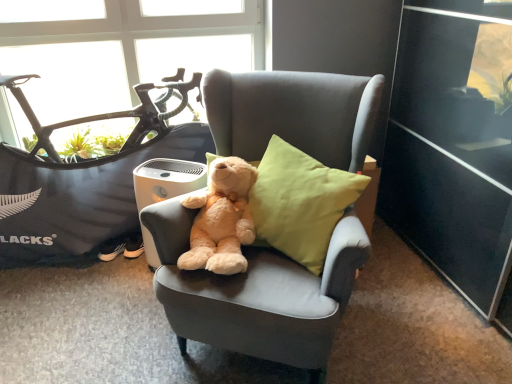
Looking at this image, measure the distance between point (x=248, y=69) and camera.

A distance of 2.42 meters exists between point (x=248, y=69) and camera.

What is the approximate width of soft gray fabric chair at center?

36.21 inches.

You are a GUI agent. You are given a task and a screenshot of the screen. Output one action in this format:
    pyautogui.click(x=<x>, y=<y>)
    Task: Click on the linen cushion at center, the second pillow positioned from the left
    This screenshot has width=512, height=384.
    Given the screenshot: What is the action you would take?
    pyautogui.click(x=300, y=203)

You are a GUI agent. You are given a task and a screenshot of the screen. Output one action in this format:
    pyautogui.click(x=<x>, y=<y>)
    Task: Click on the black matte mountain bike at left
    The image size is (512, 384).
    Given the screenshot: What is the action you would take?
    pyautogui.click(x=84, y=180)

You are a GUI agent. You are given a task and a screenshot of the screen. Output one action in this format:
    pyautogui.click(x=<x>, y=<y>)
    Task: Click on the light brown plush teddy bear at center
    
    Given the screenshot: What is the action you would take?
    221,219

Describe the element at coordinates (255, 208) in the screenshot. I see `linen-like green pillow at center, which is counted as the 1th pillow, starting from the left` at that location.

This screenshot has height=384, width=512. I want to click on transparent glass window at upper left, so [x=134, y=50].

From a real-world perspective, is soft gray fabric chair at center physically above black matte mountain bike at left?

Yes, from a real-world perspective, soft gray fabric chair at center is over black matte mountain bike at left

Measure the distance from soft gray fabric chair at center to black matte mountain bike at left.

soft gray fabric chair at center is 31.95 inches from black matte mountain bike at left.

From the image's perspective, which is above, soft gray fabric chair at center or black matte mountain bike at left?

black matte mountain bike at left, from the image's perspective.

Do you think soft gray fabric chair at center is within black matte mountain bike at left, or outside of it?

soft gray fabric chair at center exists outside the volume of black matte mountain bike at left.

Which of these two, light brown plush teddy bear at center or linen-like green pillow at center, which is counted as the 1th pillow, starting from the left, is wider?

With larger width is light brown plush teddy bear at center.

Considering the positions of points (194, 245) and (252, 198), is point (194, 245) farther from camera compared to point (252, 198)?

No, (194, 245) is in front of (252, 198).

Considering the relative positions of light brown plush teddy bear at center and linen-like green pillow at center, placed as the 2th pillow when sorted from right to left, in the image provided, is light brown plush teddy bear at center to the left or to the right of linen-like green pillow at center, placed as the 2th pillow when sorted from right to left,?

Clearly, light brown plush teddy bear at center is on the left of linen-like green pillow at center, placed as the 2th pillow when sorted from right to left, in the image.

Is light brown plush teddy bear at center shorter than linen-like green pillow at center, placed as the 2th pillow when sorted from right to left?

Yes, light brown plush teddy bear at center is shorter than linen-like green pillow at center, placed as the 2th pillow when sorted from right to left.

Which object is thinner, light brown plush teddy bear at center or black matte mountain bike at left?

black matte mountain bike at left.

Could you tell me if light brown plush teddy bear at center is turned towards black matte mountain bike at left?

No, light brown plush teddy bear at center is not turned towards black matte mountain bike at left.

From the image's perspective, is light brown plush teddy bear at center above or below black matte mountain bike at left?

Based on their image positions, light brown plush teddy bear at center is located beneath black matte mountain bike at left.

Is there a large distance between light brown plush teddy bear at center and black matte mountain bike at left?

They are positioned close to each other.

Can you confirm if light brown plush teddy bear at center is bigger than soft gray fabric chair at center?

No.

From the picture: From a real-world perspective, is light brown plush teddy bear at center on top of soft gray fabric chair at center?

Yes, from a real-world perspective, light brown plush teddy bear at center is over soft gray fabric chair at center

Does transparent glass window at upper left have a greater width compared to soft gray fabric chair at center?

In fact, transparent glass window at upper left might be narrower than soft gray fabric chair at center.

Who is more distant, transparent glass window at upper left or soft gray fabric chair at center?

transparent glass window at upper left is behind.

Does transparent glass window at upper left have a smaller size compared to soft gray fabric chair at center?

Indeed, transparent glass window at upper left has a smaller size compared to soft gray fabric chair at center.

From a real-world perspective, relative to soft gray fabric chair at center, is transparent glass window at upper left vertically above or below?

Clearly, from a real-world perspective, transparent glass window at upper left is above soft gray fabric chair at center.

From the image's perspective, which is above, light brown plush teddy bear at center or linen cushion at center, acting as the 1th pillow starting from the right?

linen cushion at center, acting as the 1th pillow starting from the right.

Is linen cushion at center, the second pillow positioned from the left, inside light brown plush teddy bear at center?

No.

Between light brown plush teddy bear at center and linen cushion at center, acting as the 1th pillow starting from the right, which one is positioned in front?

linen cushion at center, acting as the 1th pillow starting from the right, is more forward.

Is light brown plush teddy bear at center directly adjacent to linen cushion at center, acting as the 1th pillow starting from the right?

No, light brown plush teddy bear at center is not beside linen cushion at center, acting as the 1th pillow starting from the right.

How different are the orientations of linen-like green pillow at center, which is counted as the 1th pillow, starting from the left, and linen cushion at center, the second pillow positioned from the left, in degrees?

The angle between the facing direction of linen-like green pillow at center, which is counted as the 1th pillow, starting from the left, and the facing direction of linen cushion at center, the second pillow positioned from the left, is 20 degrees.

At what (x,y) coordinates should I click in order to perform the action: click on pillow above the linen cushion at center, the second pillow positioned from the left (from the image's perspective). Please return your answer as a coordinate pair (x, y). Image resolution: width=512 pixels, height=384 pixels. Looking at the image, I should click on (255, 208).

Is linen-like green pillow at center, which is counted as the 1th pillow, starting from the left, not within linen cushion at center, acting as the 1th pillow starting from the right?

No, linen-like green pillow at center, which is counted as the 1th pillow, starting from the left, is inside or overlapping with linen cushion at center, acting as the 1th pillow starting from the right.

From the image's perspective, which object appears higher, linen-like green pillow at center, which is counted as the 1th pillow, starting from the left, or linen cushion at center, the second pillow positioned from the left?

linen-like green pillow at center, which is counted as the 1th pillow, starting from the left, from the image's perspective.

Identify the location of mountain bike that is behind the soft gray fabric chair at center. (84, 180).

There is a light brown plush teddy bear at center. At what (x,y) coordinates should I click in order to perform the action: click on the 2nd pillow above it (from the image's perspective). Please return your answer as a coordinate pair (x, y). The height and width of the screenshot is (384, 512). Looking at the image, I should click on (255, 208).

From the image, which object appears to be farther from linen cushion at center, the second pillow positioned from the left, light brown plush teddy bear at center or soft gray fabric chair at center?

soft gray fabric chair at center lies further to linen cushion at center, the second pillow positioned from the left, than the other object.

From the image, which object appears to be nearer to linen cushion at center, the second pillow positioned from the left, soft gray fabric chair at center or linen-like green pillow at center, placed as the 2th pillow when sorted from right to left?

linen-like green pillow at center, placed as the 2th pillow when sorted from right to left, is positioned closer to the anchor linen cushion at center, the second pillow positioned from the left.

When comparing their distances from black matte mountain bike at left, does soft gray fabric chair at center or light brown plush teddy bear at center seem closer?

light brown plush teddy bear at center.

Looking at the image, which one is located further to light brown plush teddy bear at center, linen-like green pillow at center, which is counted as the 1th pillow, starting from the left, or soft gray fabric chair at center?

soft gray fabric chair at center is further to light brown plush teddy bear at center.

Considering their positions, is linen-like green pillow at center, placed as the 2th pillow when sorted from right to left, positioned further to light brown plush teddy bear at center than linen cushion at center, the second pillow positioned from the left?

Among the two, linen cushion at center, the second pillow positioned from the left, is located further to light brown plush teddy bear at center.

Considering their positions, is transparent glass window at upper left positioned further to soft gray fabric chair at center than black matte mountain bike at left?

Among the two, transparent glass window at upper left is located further to soft gray fabric chair at center.

Looking at the image, which one is located further to linen cushion at center, the second pillow positioned from the left, soft gray fabric chair at center or black matte mountain bike at left?

black matte mountain bike at left.

When comparing their distances from linen cushion at center, the second pillow positioned from the left, does light brown plush teddy bear at center or transparent glass window at upper left seem further?

The object further to linen cushion at center, the second pillow positioned from the left, is transparent glass window at upper left.

In order to click on pillow between black matte mountain bike at left and linen cushion at center, acting as the 1th pillow starting from the right in this screenshot , I will do `click(255, 208)`.

You are a GUI agent. You are given a task and a screenshot of the screen. Output one action in this format:
    pyautogui.click(x=<x>, y=<y>)
    Task: Click on the teddy bear between transparent glass window at upper left and linen cushion at center, the second pillow positioned from the left, in the horizontal direction
    Image resolution: width=512 pixels, height=384 pixels.
    Given the screenshot: What is the action you would take?
    pyautogui.click(x=221, y=219)

Where is `window between black matte mountain bike at left and linen-like green pillow at center, which is counted as the 1th pillow, starting from the left, from left to right`? Image resolution: width=512 pixels, height=384 pixels. window between black matte mountain bike at left and linen-like green pillow at center, which is counted as the 1th pillow, starting from the left, from left to right is located at coordinates (134, 50).

The width and height of the screenshot is (512, 384). What are the coordinates of `teddy bear located between black matte mountain bike at left and soft gray fabric chair at center in the left-right direction` in the screenshot? It's located at (221, 219).